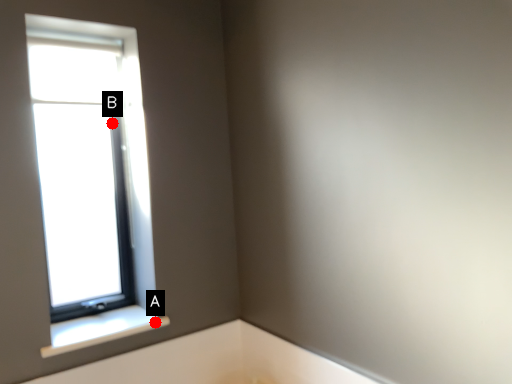
Question: Two points are circled on the image, labeled by A and B beside each circle. Which point is closer to the camera?

Choices:
 (A) A is closer
 (B) B is closer

Answer: (A)